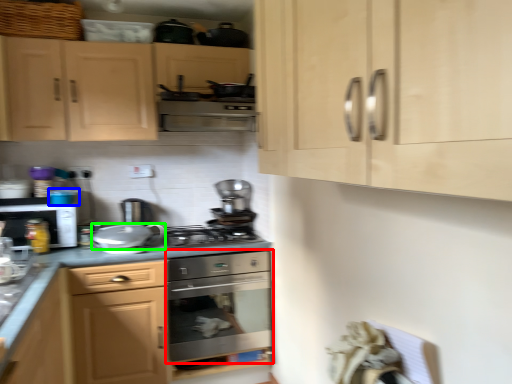
Question: Which object is the farthest from home appliance (highlighted by a red box)? Choose among these: appliance (highlighted by a blue box) or appliance (highlighted by a green box).

Choices:
 (A) appliance
 (B) appliance

Answer: (A)